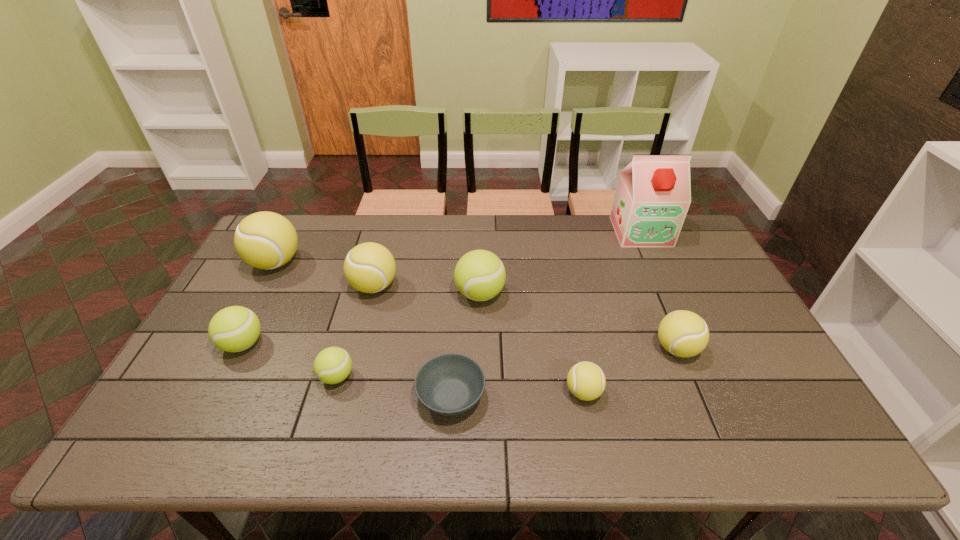
In the image, there is a desktop. Identify the location of vacant space at the near edge. (604, 437).

Find the location of a particular element. Image resolution: width=960 pixels, height=540 pixels. free region at the left edge of the desktop is located at coordinates (193, 349).

You are a GUI agent. You are given a task and a screenshot of the screen. Output one action in this format:
    pyautogui.click(x=<x>, y=<y>)
    Task: Click on the free point at the right edge
    The width and height of the screenshot is (960, 540).
    Given the screenshot: What is the action you would take?
    pyautogui.click(x=747, y=342)

You are a GUI agent. You are given a task and a screenshot of the screen. Output one action in this format:
    pyautogui.click(x=<x>, y=<y>)
    Task: Click on the free spot at the near right corner of the desktop
    This screenshot has height=540, width=960.
    Given the screenshot: What is the action you would take?
    pyautogui.click(x=796, y=454)

The width and height of the screenshot is (960, 540). What are the coordinates of `free space between the soya milk and the smallest green tennis ball` in the screenshot? It's located at (489, 304).

Find the location of a particular element. This screenshot has width=960, height=540. free space between the third smallest yellow tennis ball and the tallest object is located at coordinates (508, 259).

Find the location of a particular element. This screenshot has width=960, height=540. free space between the soup bowl and the tallest object is located at coordinates click(x=546, y=314).

At what (x,y) coordinates should I click in order to perform the action: click on free space between the second smallest green tennis ball and the second green tennis ball from left to right. Please return your answer as a coordinate pair (x, y). This screenshot has height=540, width=960. Looking at the image, I should click on (290, 360).

The height and width of the screenshot is (540, 960). Identify the location of free spot between the soya milk and the second tallest object. (458, 247).

You are a GUI agent. You are given a task and a screenshot of the screen. Output one action in this format:
    pyautogui.click(x=<x>, y=<y>)
    Task: Click on the free space between the smallest yellow tennis ball and the soup bowl
    
    Given the screenshot: What is the action you would take?
    pyautogui.click(x=517, y=394)